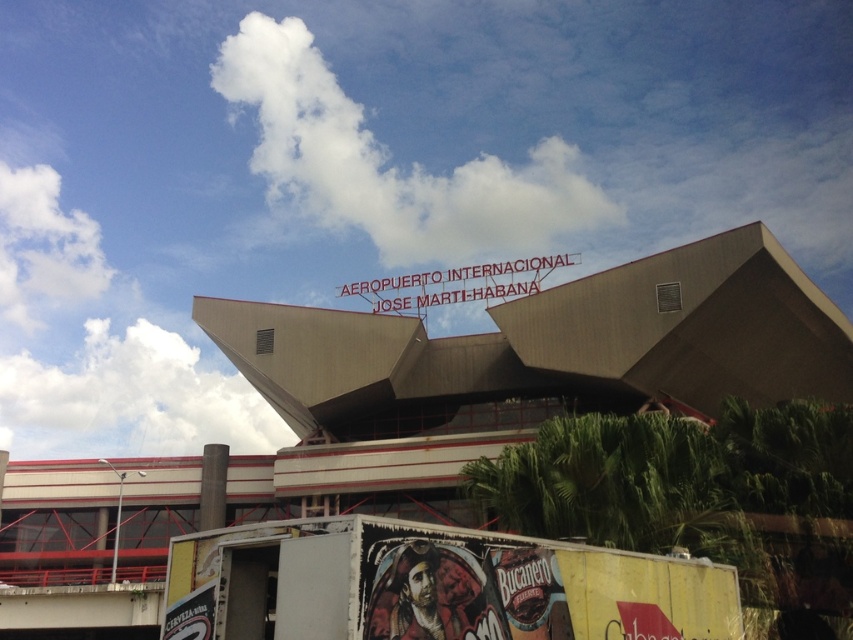
Who is positioned more to the right, brown corrugated metal building at center or white fluffy cloud at upper center?

From the viewer's perspective, white fluffy cloud at upper center appears more on the right side.

Is brown corrugated metal building at center above white fluffy cloud at upper center?

No.

Does point (309, 492) come behind point (260, 35)?

No, it is in front of (260, 35).

This screenshot has width=853, height=640. Identify the location of brown corrugated metal building at center. (485, 385).

Who is higher up, brown corrugated metal building at center or yellow matte trailer truck at lower center?

Positioned higher is brown corrugated metal building at center.

Is point (250, 353) positioned behind point (612, 570)?

That is True.

Between point (618, 278) and point (695, 586), which one is positioned behind?

Point (618, 278)

What are the coordinates of `brown corrugated metal building at center` in the screenshot? It's located at (485, 385).

Is point (331, 568) closer to viewer compared to point (241, 419)?

Yes.

You are a GUI agent. You are given a task and a screenshot of the screen. Output one action in this format:
    pyautogui.click(x=<x>, y=<y>)
    Task: Click on the yellow matte trailer truck at lower center
    The height and width of the screenshot is (640, 853).
    Given the screenshot: What is the action you would take?
    pyautogui.click(x=433, y=586)

At what (x,y) coordinates should I click in order to perform the action: click on yellow matte trailer truck at lower center. Please return your answer as a coordinate pair (x, y). Looking at the image, I should click on (433, 586).